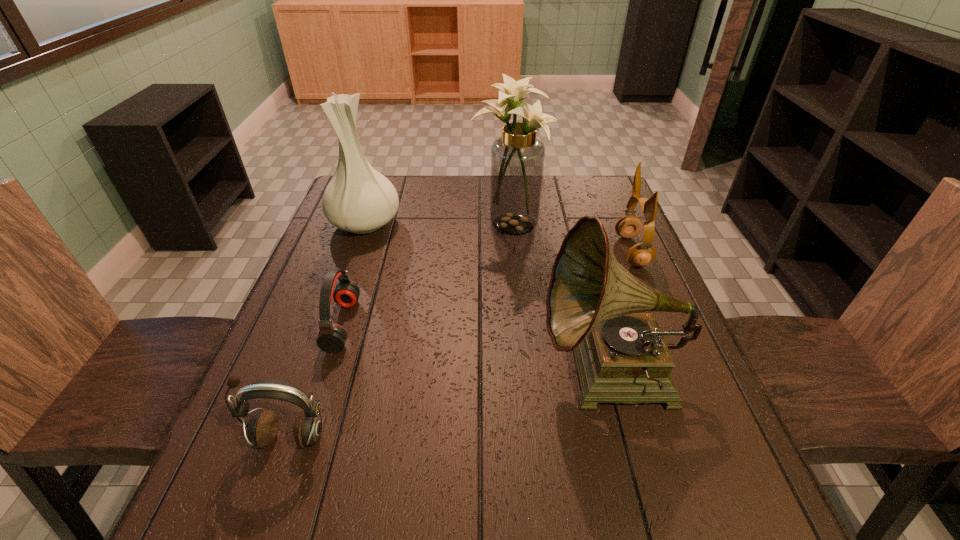
Identify the location of vacant space in between the vase and the flower arrangement. (437, 224).

Find the location of a particular element. empty location between the rightmost earphone and the vase is located at coordinates (498, 237).

Where is `empty location between the vase and the flower arrangement`? The image size is (960, 540). empty location between the vase and the flower arrangement is located at coordinates (437, 224).

You are a GUI agent. You are given a task and a screenshot of the screen. Output one action in this format:
    pyautogui.click(x=<x>, y=<y>)
    Task: Click on the vacant area between the shortest earphone and the farthest earphone
    
    Given the screenshot: What is the action you would take?
    pyautogui.click(x=487, y=288)

In order to click on vacant area between the vase and the record player in this screenshot , I will do `click(488, 299)`.

Choose which object is the nearest neighbor to the shortest earphone. Please provide its 2D coordinates. Your answer should be formatted as a tuple, i.e. [(x, y)], where the tuple contains the x and y coordinates of a point satisfying the conditions above.

[(263, 427)]

Locate an element on the screen. This screenshot has height=540, width=960. the third closest object relative to the shortest earphone is located at coordinates (517, 158).

Identify which earphone is the second nearest to the vase. Please provide its 2D coordinates. Your answer should be formatted as a tuple, i.e. [(x, y)], where the tuple contains the x and y coordinates of a point satisfying the conditions above.

[(263, 427)]

Where is `earphone object that ranks as the closest to the shortest object`? Image resolution: width=960 pixels, height=540 pixels. earphone object that ranks as the closest to the shortest object is located at coordinates (263, 427).

Locate an element on the screen. vacant area in the image that satisfies the following two spatial constraints: 1. on the ear cups of the shortest object; 2. on the ear pads of the nearest earphone is located at coordinates (306, 437).